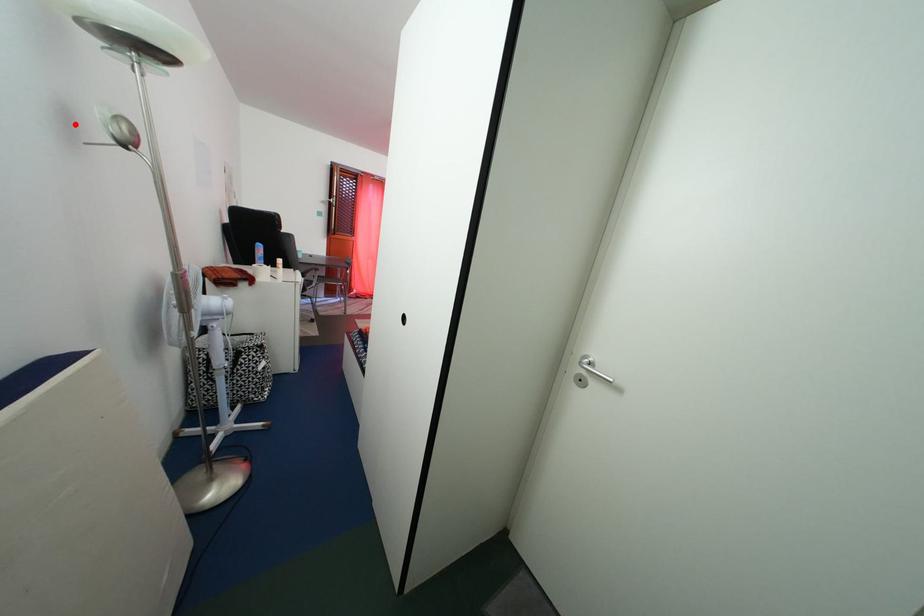
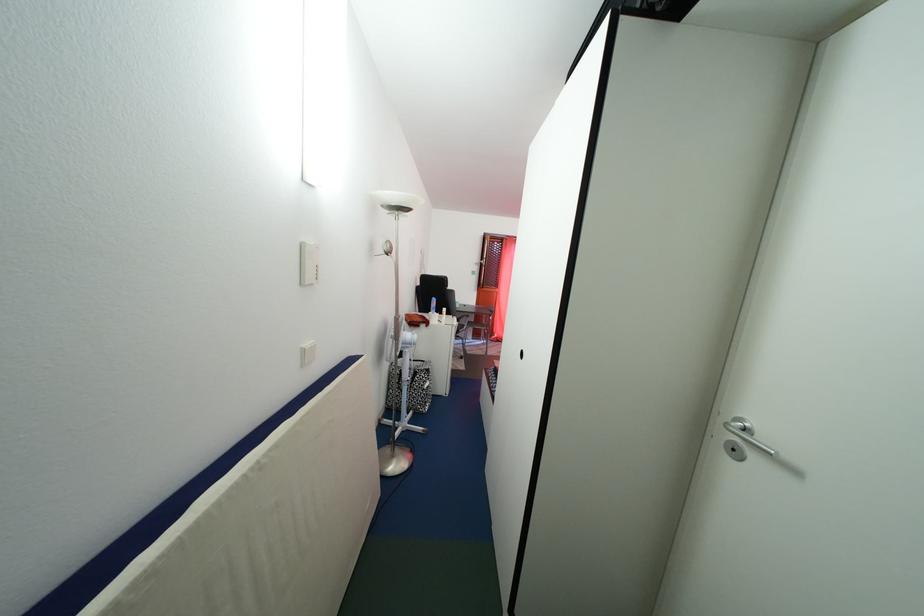
The point at the highlighted location is marked in the first image. Where is the corresponding point in the second image?

(381, 253)